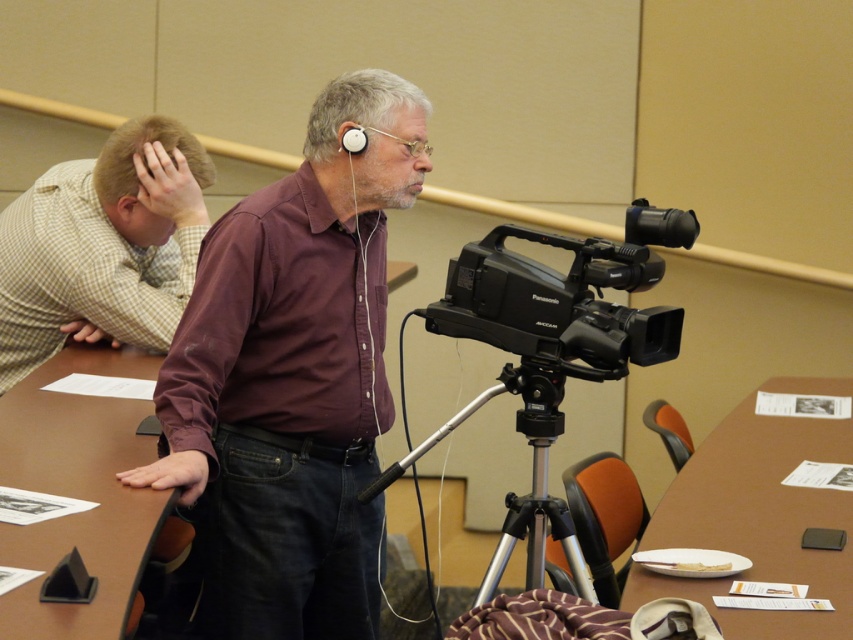
Question: Based on their relative distances, which object is nearer to the brown wood table at center?

Choices:
 (A) checkered fabric shirt at left
 (B) maroon shirt at center
 (C) silver metallic tripod at center
 (D) black plastic video camera at center

Answer: (A)

Question: Considering the real-world distances, which object is farthest from the maroon shirt at center?

Choices:
 (A) black plastic video camera at center
 (B) white plastic earphone at upper center

Answer: (B)

Question: Is black plastic video camera at center bigger than brown wood table at lower right?

Choices:
 (A) yes
 (B) no

Answer: (B)

Question: From the image, what is the correct spatial relationship of brown wood table at center in relation to white plastic earphone at upper center?

Choices:
 (A) left
 (B) right

Answer: (A)

Question: Which point is farther from the camera taking this photo?

Choices:
 (A) (228, 628)
 (B) (590, 314)
 (C) (187, 144)
 (D) (426, 440)

Answer: (C)

Question: Can you confirm if brown wood table at center is bigger than black plastic camera at center?

Choices:
 (A) yes
 (B) no

Answer: (A)